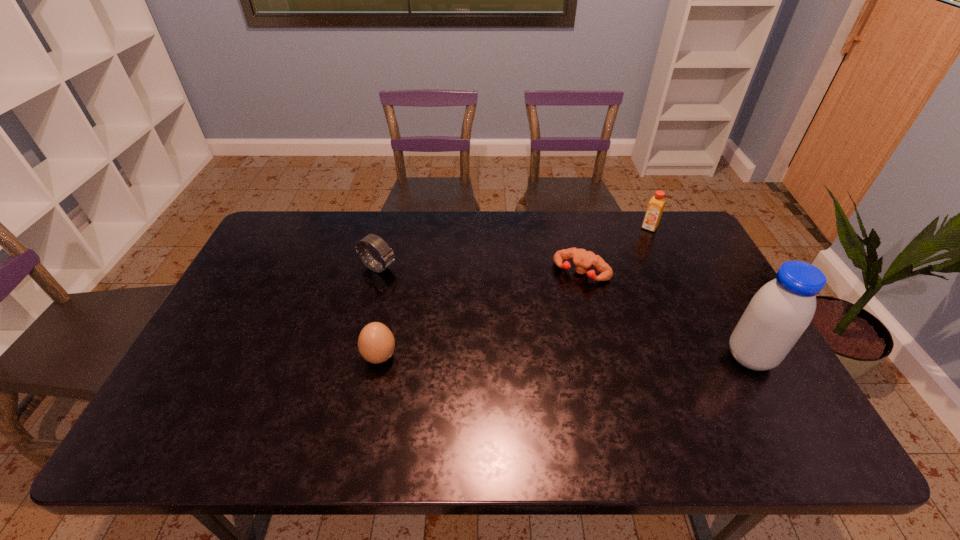
Locate an element on the screen. free spot between the watch and the boiled egg is located at coordinates (379, 313).

Identify the location of empty space between the watch and the fourth shortest object. The width and height of the screenshot is (960, 540). (514, 248).

This screenshot has height=540, width=960. Find the location of `free spot between the second object from right to left and the soya milk`. free spot between the second object from right to left and the soya milk is located at coordinates (700, 292).

Identify the location of free area in between the boiled egg and the second tallest object. (515, 292).

The width and height of the screenshot is (960, 540). I want to click on vacant region between the fourth object from left to right and the shortest object, so click(x=615, y=250).

Where is `vacant point located between the watch and the puncher`? The height and width of the screenshot is (540, 960). vacant point located between the watch and the puncher is located at coordinates (480, 270).

The height and width of the screenshot is (540, 960). Find the location of `blank region between the rightmost object and the farthest object`. blank region between the rightmost object and the farthest object is located at coordinates (700, 292).

Identify which object is the second closest to the watch. Please provide its 2D coordinates. Your answer should be formatted as a tuple, i.e. [(x, y)], where the tuple contains the x and y coordinates of a point satisfying the conditions above.

[(583, 259)]

Where is `the fourth closest object relative to the soya milk`? the fourth closest object relative to the soya milk is located at coordinates (387, 256).